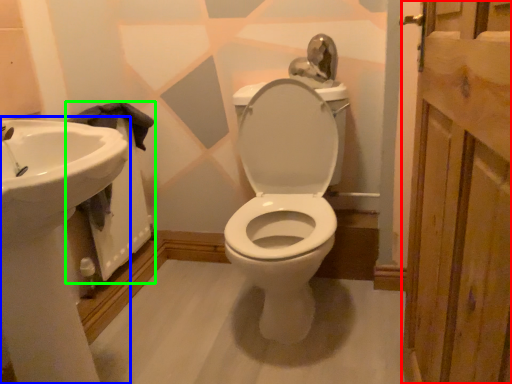
Question: Estimate the real-world distances between objects in this image. Which object is closer to screen door (highlighted by a red box), sink (highlighted by a blue box) or bath (highlighted by a green box)?

Choices:
 (A) sink
 (B) bath

Answer: (A)